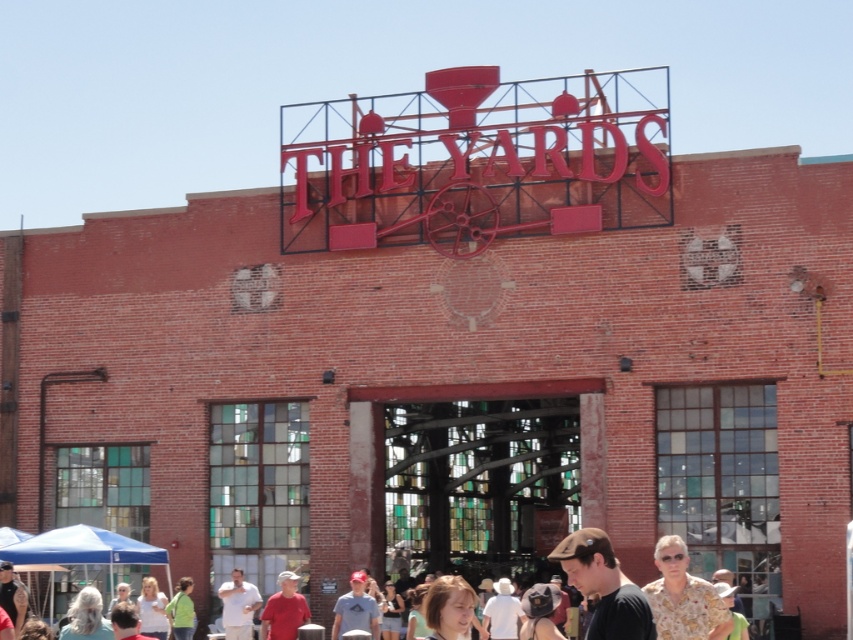
You are at THE YARDS and want to find the person wearing the matte gray cap at center. Which direction should you look relative to the floral shirt at lower right?

The floral shirt at lower right is located above the matte gray cap at center, so you should look downward from the floral shirt at lower right to find the matte gray cap at center.

Looking at this image, you are standing in front of THE YARDS building and want to take a photo of both the point at coordinates (242,605) and the point at coordinates (351,612). Which point should you focus on first to ensure both are in clear view?

You should focus on the point at coordinates (242,605) first because it is closer to you than the point at coordinates (351,612), ensuring both are in clear view.

In the scene shown: You are at THE YARDS event and need to find a place to sit. You see a brown cap at lower center and a brown fabric shirt at lower center. Which object is narrower so it might have more space around it?

The brown cap at lower center is thinner than the brown fabric shirt at lower center, so it might have more space around it.